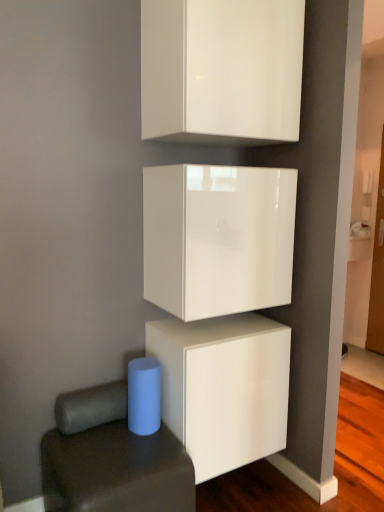
I want to click on vacant region above blue matte cylinder at lower left (from a real-world perspective), so click(x=115, y=449).